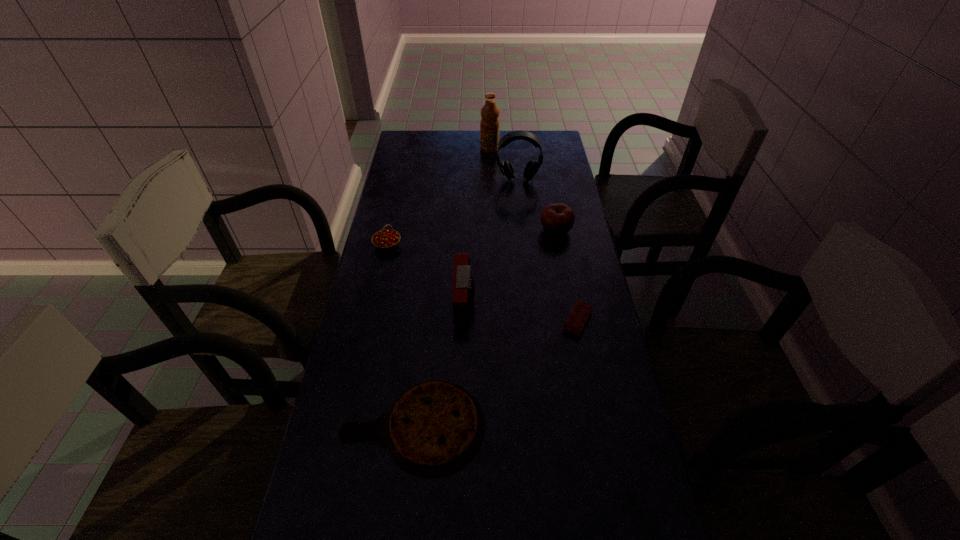
Image resolution: width=960 pixels, height=540 pixels. In order to click on the tallest object in this screenshot , I will do [x=489, y=125].

Where is `the farthest object`? This screenshot has width=960, height=540. the farthest object is located at coordinates (489, 125).

Image resolution: width=960 pixels, height=540 pixels. What are the coordinates of `the sixth nearest object` in the screenshot? It's located at (532, 167).

Find the location of a particular element. This screenshot has width=960, height=540. earphone is located at coordinates click(x=532, y=167).

Where is `camera`? camera is located at coordinates (463, 283).

Locate an element on the screen. apple is located at coordinates (557, 219).

Find the location of `the third shortest object`. the third shortest object is located at coordinates (386, 239).

Where is `pizza`? This screenshot has width=960, height=540. pizza is located at coordinates (433, 428).

What are the coordinates of `Lego` in the screenshot? It's located at (581, 312).

This screenshot has height=540, width=960. I want to click on free location located 0.130m on the label side of the fruit juice, so click(x=450, y=148).